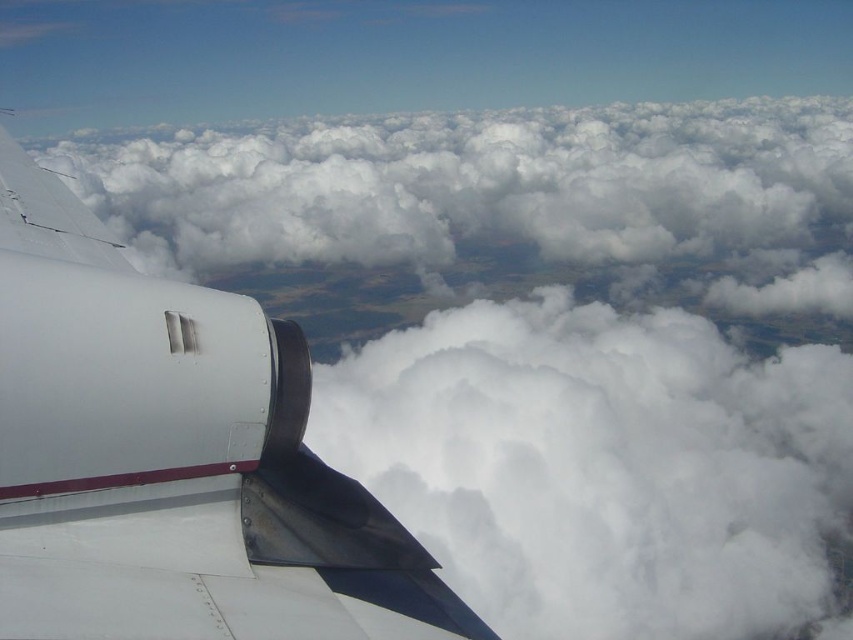
Question: Considering the relative positions of white fluffy cloud at center and white fluffy cloud at upper center in the image provided, where is white fluffy cloud at center located with respect to white fluffy cloud at upper center?

Choices:
 (A) right
 (B) left

Answer: (A)

Question: Does white matte airplane wing at left appear over metallic silver engine at lower left?

Choices:
 (A) yes
 (B) no

Answer: (A)

Question: Is white matte airplane wing at left smaller than metallic silver engine at lower left?

Choices:
 (A) no
 (B) yes

Answer: (A)

Question: Which point is farther to the camera?

Choices:
 (A) (781, 300)
 (B) (251, 432)
 (C) (804, 540)

Answer: (A)

Question: Among these points, which one is farthest from the camera?

Choices:
 (A) (165, 310)
 (B) (258, 140)
 (C) (97, 468)
 (D) (724, 524)

Answer: (B)

Question: Which object is positioned farthest from the white fluffy cloud at upper center?

Choices:
 (A) metallic gray winglet at upper left
 (B) white matte airplane wing at left
 (C) white fluffy cloud at center
 (D) metallic silver engine at lower left

Answer: (D)